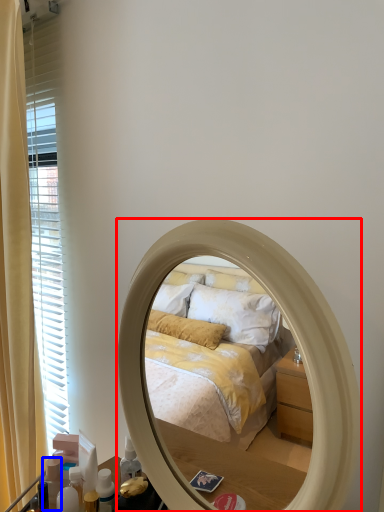
Question: Which of the following is the closest to the observer, mirror (highlighted by a red box) or toiletry (highlighted by a blue box)?

Choices:
 (A) mirror
 (B) toiletry

Answer: (A)